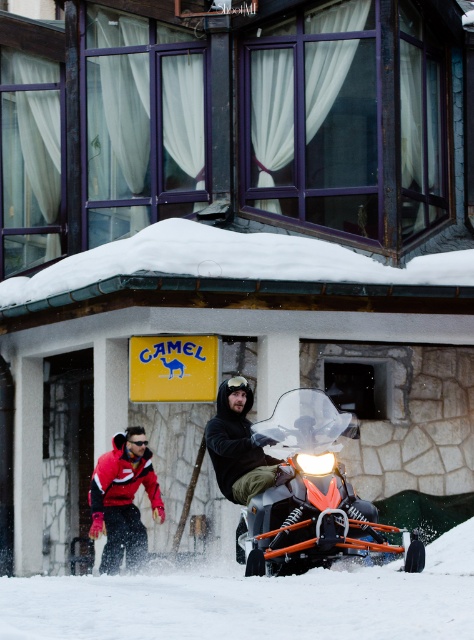
From the picture: Does white powdery snow at lower center have a lesser height compared to orange metallic snowmobile at center?

Indeed, white powdery snow at lower center has a lesser height compared to orange metallic snowmobile at center.

The height and width of the screenshot is (640, 474). What are the coordinates of `white powdery snow at lower center` in the screenshot? It's located at (253, 602).

The image size is (474, 640). Find the location of `white powdery snow at lower center`. white powdery snow at lower center is located at coordinates (253, 602).

Between orange metallic snowmobile at center and black matte jacket at center, which one appears on the right side from the viewer's perspective?

Positioned to the right is orange metallic snowmobile at center.

Does orange metallic snowmobile at center appear on the right side of black matte jacket at center?

Correct, you'll find orange metallic snowmobile at center to the right of black matte jacket at center.

At what (x,y) coordinates should I click in order to perform the action: click on orange metallic snowmobile at center. Please return your answer as a coordinate pair (x, y). The height and width of the screenshot is (640, 474). Looking at the image, I should click on (310, 497).

The width and height of the screenshot is (474, 640). I want to click on orange metallic snowmobile at center, so click(x=310, y=497).

Is red fleece jacket at lower left to the left of black matte jacket at center from the viewer's perspective?

Indeed, red fleece jacket at lower left is positioned on the left side of black matte jacket at center.

Does red fleece jacket at lower left appear on the right side of black matte jacket at center?

No, red fleece jacket at lower left is not to the right of black matte jacket at center.

Is point (138, 545) positioned before point (271, 461)?

No, (138, 545) is behind (271, 461).

Image resolution: width=474 pixels, height=640 pixels. In order to click on red fleece jacket at lower left in this screenshot , I will do `click(122, 499)`.